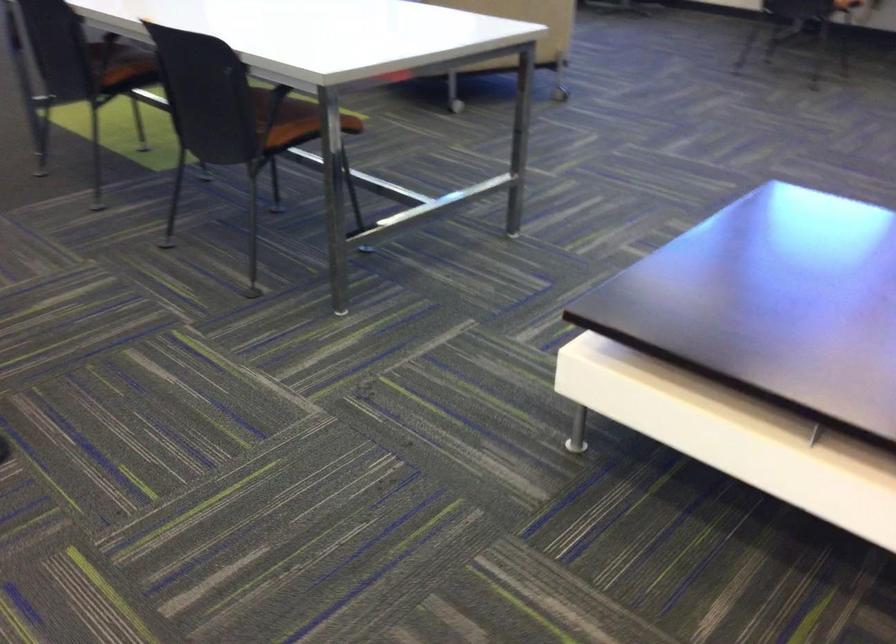
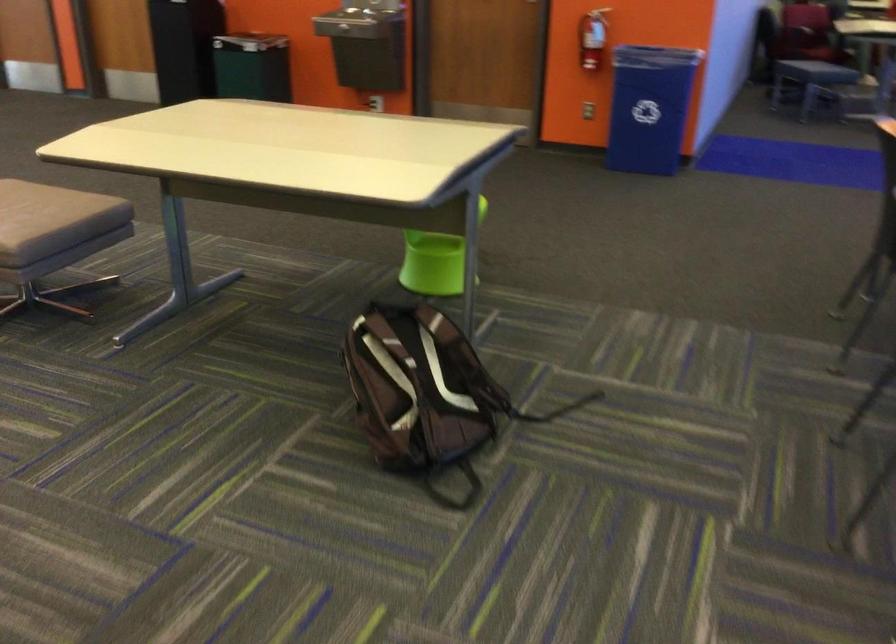
Question: How did the camera likely rotate?

Choices:
 (A) Left
 (B) Right
 (C) Up
 (D) Down

Answer: (A)